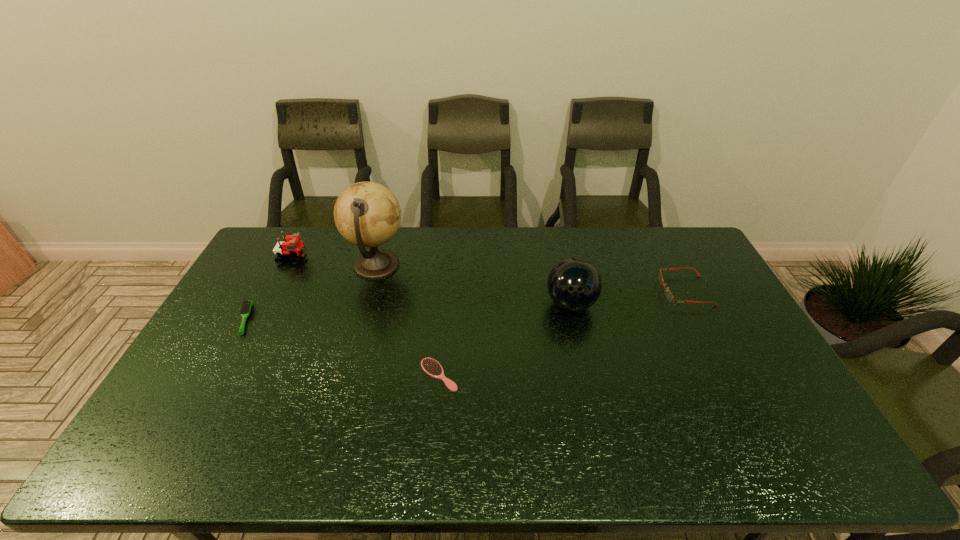
Find the location of a particular element. The width and height of the screenshot is (960, 540). blank region between the rightmost object and the bowling ball is located at coordinates (628, 298).

The height and width of the screenshot is (540, 960). I want to click on unoccupied position between the rightmost object and the tallest object, so click(531, 278).

Image resolution: width=960 pixels, height=540 pixels. Identify the location of vacant area that lies between the fifth object from left to right and the third tallest object. (432, 281).

Find the location of a particular element. unoccupied area between the tallest object and the shortest object is located at coordinates (408, 320).

The height and width of the screenshot is (540, 960). What are the coordinates of `vacant space in between the fourth object from left to right and the tallest object` in the screenshot? It's located at (408, 320).

The width and height of the screenshot is (960, 540). I want to click on vacant region between the right hairbrush and the Lego, so click(366, 316).

The width and height of the screenshot is (960, 540). What are the coordinates of `vacant area that lies between the bowling ball and the fourth tallest object` in the screenshot? It's located at (628, 298).

I want to click on empty space that is in between the rightmost object and the taller hairbrush, so click(465, 305).

I want to click on free area in between the left hairbrush and the Lego, so 269,288.

Find the location of a particular element. This screenshot has height=540, width=960. blank region between the rightmost object and the second object from right to left is located at coordinates (628, 298).